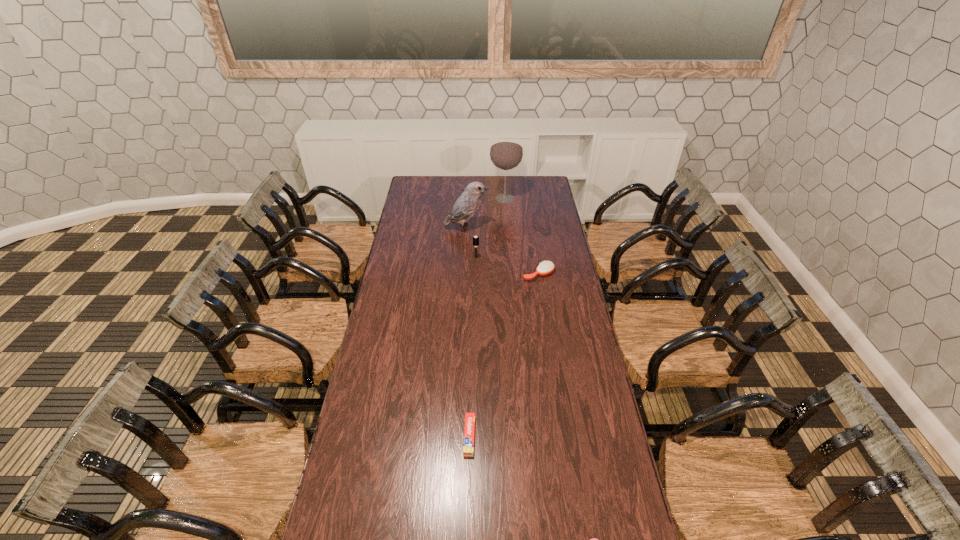
Identify which hairbrush is the second nearest to the second tallest hairbrush. Please provide its 2D coordinates. Your answer should be formatted as a tuple, i.e. [(x, y)], where the tuple contains the x and y coordinates of a point satisfying the conditions above.

[(593, 539)]

Identify which hairbrush is the closest to the nearest object. Please provide its 2D coordinates. Your answer should be formatted as a tuple, i.e. [(x, y)], where the tuple contains the x and y coordinates of a point satisfying the conditions above.

[(546, 267)]

Find the location of `vacant space that satisfies the following two spatial constraints: 1. on the front-facing side of the fifth nearest object; 2. on the back side of the second shortest hairbrush`. vacant space that satisfies the following two spatial constraints: 1. on the front-facing side of the fifth nearest object; 2. on the back side of the second shortest hairbrush is located at coordinates (465, 274).

Find the location of a particular element. This screenshot has height=540, width=960. free region that satisfies the following two spatial constraints: 1. on the back side of the farthest hairbrush; 2. on the front-facing side of the fifth shortest object is located at coordinates (476, 228).

Where is `vacant space that satisfies the following two spatial constraints: 1. on the front-facing side of the fifth nearest object; 2. on the right side of the leftmost hairbrush`? This screenshot has width=960, height=540. vacant space that satisfies the following two spatial constraints: 1. on the front-facing side of the fifth nearest object; 2. on the right side of the leftmost hairbrush is located at coordinates (466, 258).

Image resolution: width=960 pixels, height=540 pixels. What are the coordinates of `vacant area in the image that satisfies the following two spatial constraints: 1. on the front-facing side of the parrot; 2. on the back side of the leftmost hairbrush` in the screenshot? It's located at (466, 258).